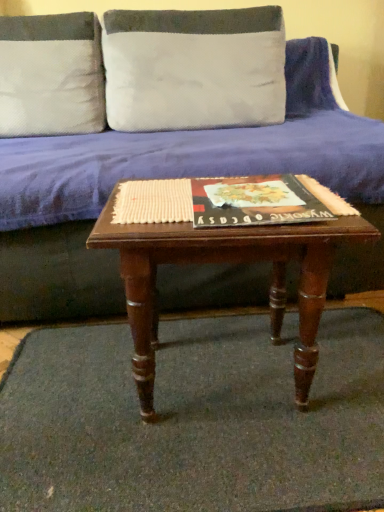
Locate an element on the screen. The width and height of the screenshot is (384, 512). empty space that is ontop of green carpet at center (from a real-world perspective) is located at coordinates (210, 396).